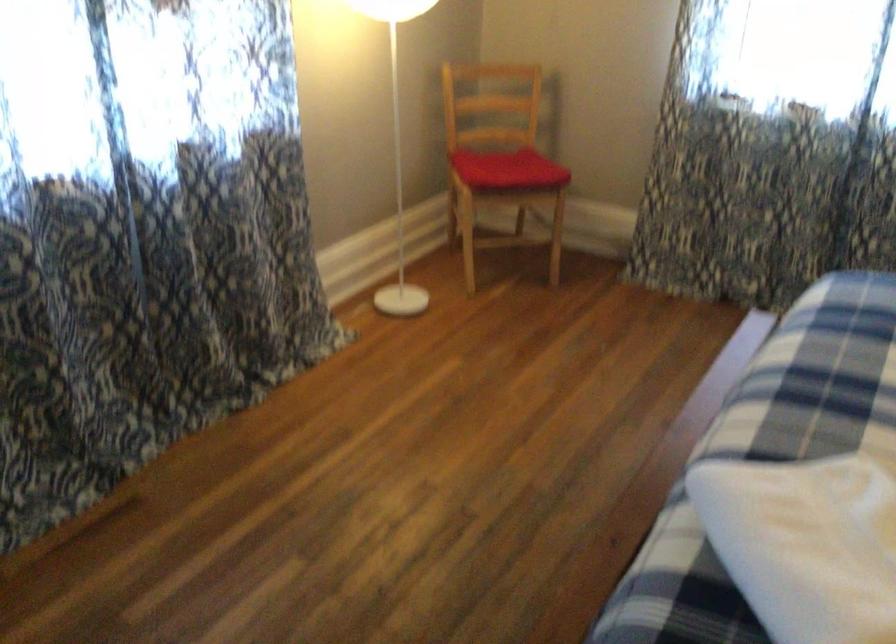
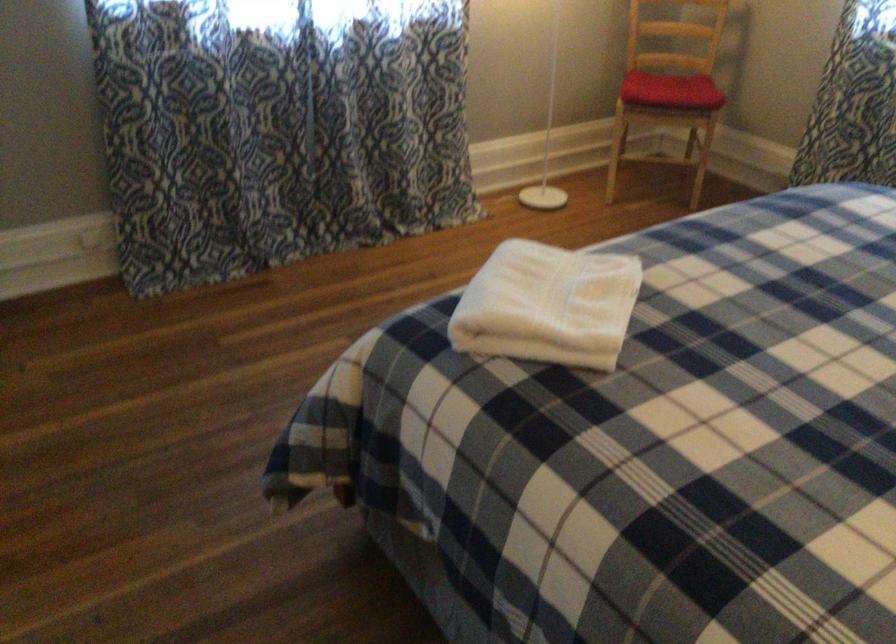
Find the pixel in the second image that matches the point at 513,178 in the first image.

(670, 90)